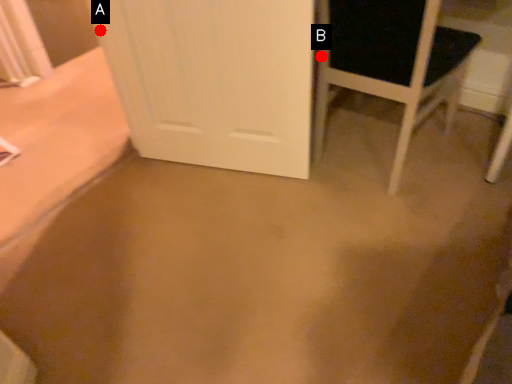
Question: Two points are circled on the image, labeled by A and B beside each circle. Which point is closer to the camera taking this photo?

Choices:
 (A) A is closer
 (B) B is closer

Answer: (B)